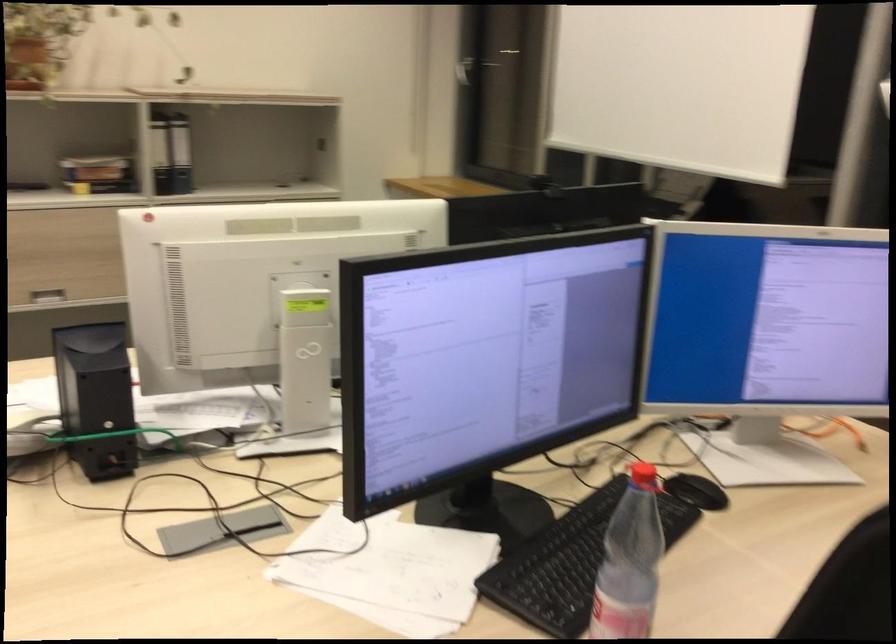
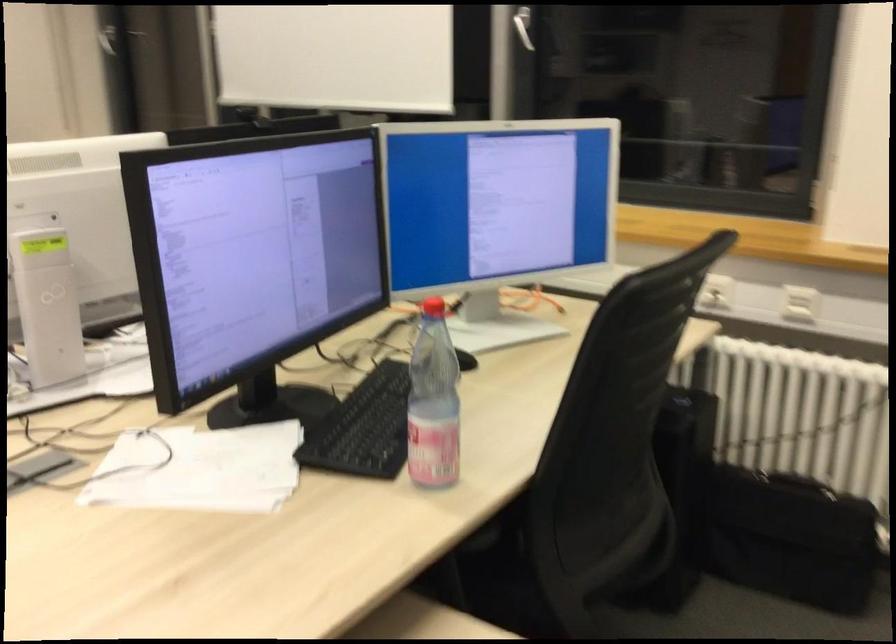
The point at (382,564) is marked in the first image. Where is the corresponding point in the second image?

(199, 469)